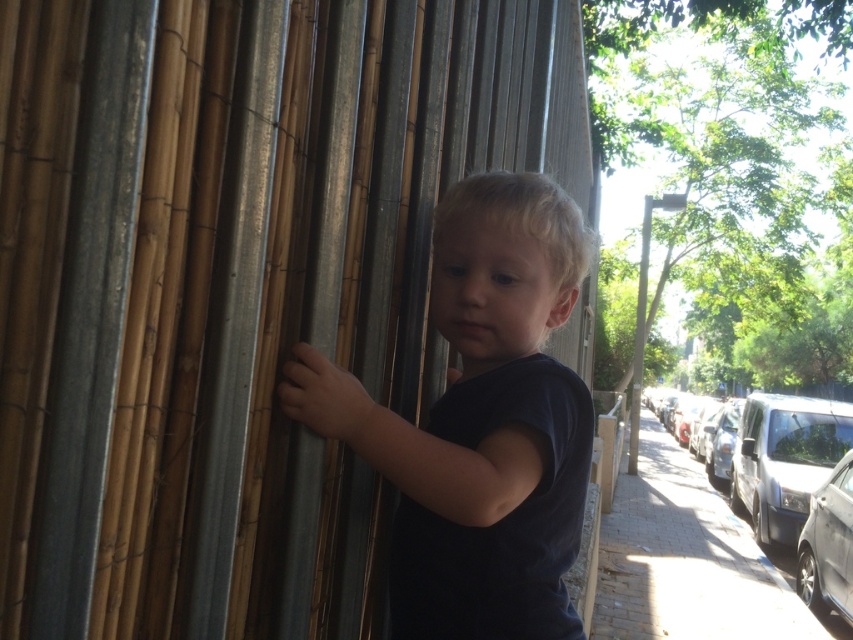
Which is more to the right, natural bamboo forest at center or dark blue shirt at center?

From the viewer's perspective, natural bamboo forest at center appears more on the right side.

In order to click on natural bamboo forest at center in this screenshot , I will do click(233, 285).